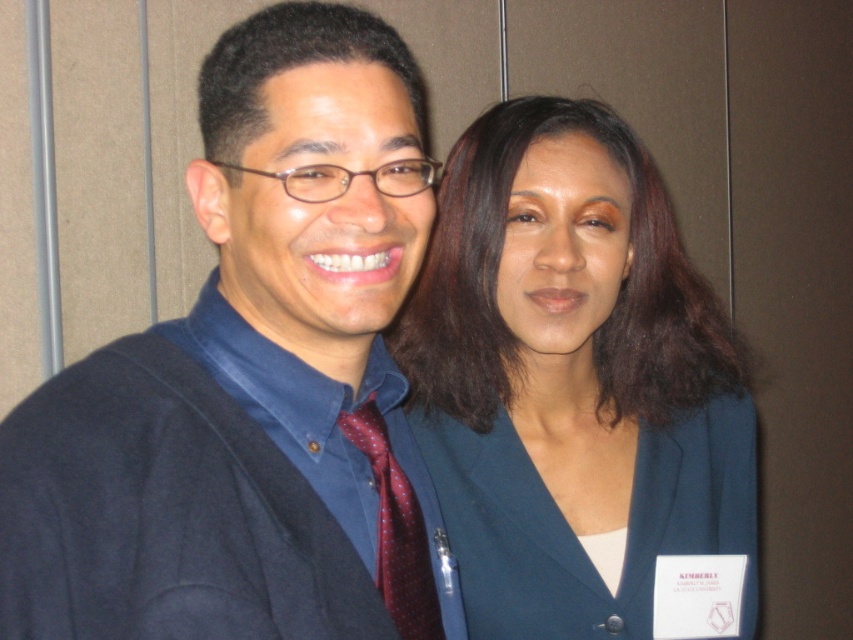
You are organizing a charity event and need to hang a 12 inch wide poster between the smooth dark blue blazer at center and the blue cotton dress shirt at left. Is there enough space?

The smooth dark blue blazer at center is larger than the blue cotton dress shirt at left. However, the exact distance between them isn not specified in the description, so we cannot determine if there is enough space for the 12 inch poster.

What are the coordinates of the smooth dark blue blazer at center?

The smooth dark blue blazer at center is located at coordinates point [572,380].